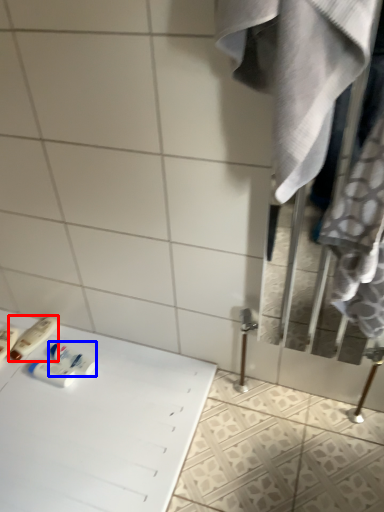
Question: Which object appears closest to the camera in this image, toiletry (highlighted by a red box) or mouthwash (highlighted by a blue box)?

Choices:
 (A) toiletry
 (B) mouthwash

Answer: (B)